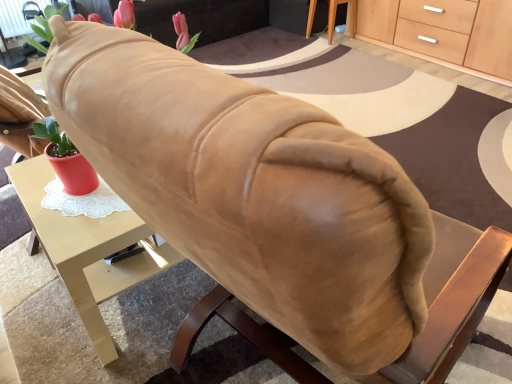
Question: Can you confirm if matte gold desk at center is bigger than wooden table at lower right?

Choices:
 (A) yes
 (B) no

Answer: (A)

Question: Is matte gold desk at center taller than wooden table at lower right?

Choices:
 (A) no
 (B) yes

Answer: (B)

Question: Is matte gold desk at center next to wooden table at lower right and touching it?

Choices:
 (A) yes
 (B) no

Answer: (B)

Question: Can you confirm if matte gold desk at center is shorter than wooden table at lower right?

Choices:
 (A) no
 (B) yes

Answer: (A)

Question: Would you say matte gold desk at center contains wooden table at lower right?

Choices:
 (A) no
 (B) yes

Answer: (A)

Question: From a real-world perspective, is matte gold desk at center above or below wooden table at lower right?

Choices:
 (A) below
 (B) above

Answer: (B)

Question: In the image, is matte gold desk at center positioned in front of or behind wooden table at lower right?

Choices:
 (A) front
 (B) behind

Answer: (A)

Question: Which is correct: matte gold desk at center is inside wooden table at lower right, or outside of it?

Choices:
 (A) outside
 (B) inside

Answer: (A)

Question: From the image's perspective, is matte gold desk at center positioned above or below wooden table at lower right?

Choices:
 (A) above
 (B) below

Answer: (B)

Question: Considering the positions of matte gold desk at center and suede-like beige couch at upper center in the image, is matte gold desk at center taller or shorter than suede-like beige couch at upper center?

Choices:
 (A) short
 (B) tall

Answer: (A)

Question: Visually, is matte gold desk at center positioned to the left or to the right of suede-like beige couch at upper center?

Choices:
 (A) right
 (B) left

Answer: (A)

Question: Considering the positions of matte gold desk at center and suede-like beige couch at upper center in the image, is matte gold desk at center wider or thinner than suede-like beige couch at upper center?

Choices:
 (A) wide
 (B) thin

Answer: (B)

Question: From a real-world perspective, is matte gold desk at center above or below suede-like beige couch at upper center?

Choices:
 (A) above
 (B) below

Answer: (B)

Question: From their relative heights in the image, would you say light wood/wooden cabinet at upper right is taller or shorter than wooden table at lower right?

Choices:
 (A) tall
 (B) short

Answer: (A)

Question: From the image's perspective, is light wood/wooden cabinet at upper right above or below wooden table at lower right?

Choices:
 (A) above
 (B) below

Answer: (B)